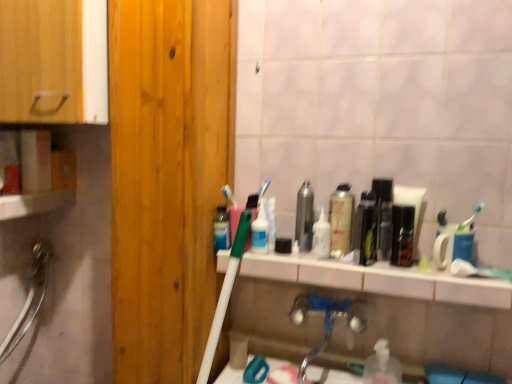
Question: Can you confirm if shiny metallic mouthwash at center, the third mouthwash in the right-to-left sequence, is thinner than white glossy toothpaste tube at center, which ranks as the 1th toiletry in left-to-right order?

Choices:
 (A) no
 (B) yes

Answer: (A)

Question: Can you confirm if shiny metallic mouthwash at center, the 4th mouthwash in the left-to-right sequence, is positioned to the right of white glossy toothpaste tube at center, which ranks as the 1th toiletry in left-to-right order?

Choices:
 (A) yes
 (B) no

Answer: (A)

Question: Is shiny metallic mouthwash at center, the 4th mouthwash in the left-to-right sequence, not near white glossy toothpaste tube at center, positioned as the 2th toiletry in right-to-left order?

Choices:
 (A) yes
 (B) no

Answer: (B)

Question: Are shiny metallic mouthwash at center, the 4th mouthwash in the left-to-right sequence, and white glossy toothpaste tube at center, which ranks as the 1th toiletry in left-to-right order, making contact?

Choices:
 (A) no
 (B) yes

Answer: (A)

Question: From a real-world perspective, is shiny metallic mouthwash at center, the third mouthwash in the right-to-left sequence, positioned over white glossy toothpaste tube at center, which ranks as the 1th toiletry in left-to-right order, based on gravity?

Choices:
 (A) yes
 (B) no

Answer: (A)

Question: Is white glossy toothpaste tube at center, positioned as the 2th toiletry in right-to-left order, located within shiny metallic mouthwash at center, the 4th mouthwash in the left-to-right sequence?

Choices:
 (A) no
 (B) yes

Answer: (A)

Question: Is clear plastic bottle at lower center, positioned as the 5th mouthwash in left-to-right order, inside black glossy mouthwash at center, acting as the 6th mouthwash starting from the left?

Choices:
 (A) yes
 (B) no

Answer: (B)

Question: Is black glossy mouthwash at center, acting as the 6th mouthwash starting from the left, next to clear plastic bottle at lower center, positioned as the 5th mouthwash in left-to-right order, and touching it?

Choices:
 (A) yes
 (B) no

Answer: (B)

Question: Is black glossy mouthwash at center, which is counted as the first mouthwash, starting from the right, shorter than clear plastic bottle at lower center, the 2th mouthwash positioned from the right?

Choices:
 (A) no
 (B) yes

Answer: (A)

Question: Is the position of black glossy mouthwash at center, which is counted as the first mouthwash, starting from the right, more distant than that of clear plastic bottle at lower center, the 2th mouthwash positioned from the right?

Choices:
 (A) yes
 (B) no

Answer: (A)

Question: Is clear plastic bottle at lower center, positioned as the 5th mouthwash in left-to-right order, at the back of black glossy mouthwash at center, acting as the 6th mouthwash starting from the left?

Choices:
 (A) yes
 (B) no

Answer: (B)

Question: Does black glossy mouthwash at center, acting as the 6th mouthwash starting from the left, have a greater width compared to clear plastic bottle at lower center, the 2th mouthwash positioned from the right?

Choices:
 (A) yes
 (B) no

Answer: (B)

Question: From the image's perspective, is light brown wood door at left under silver metallic faucet at lower center?

Choices:
 (A) yes
 (B) no

Answer: (B)